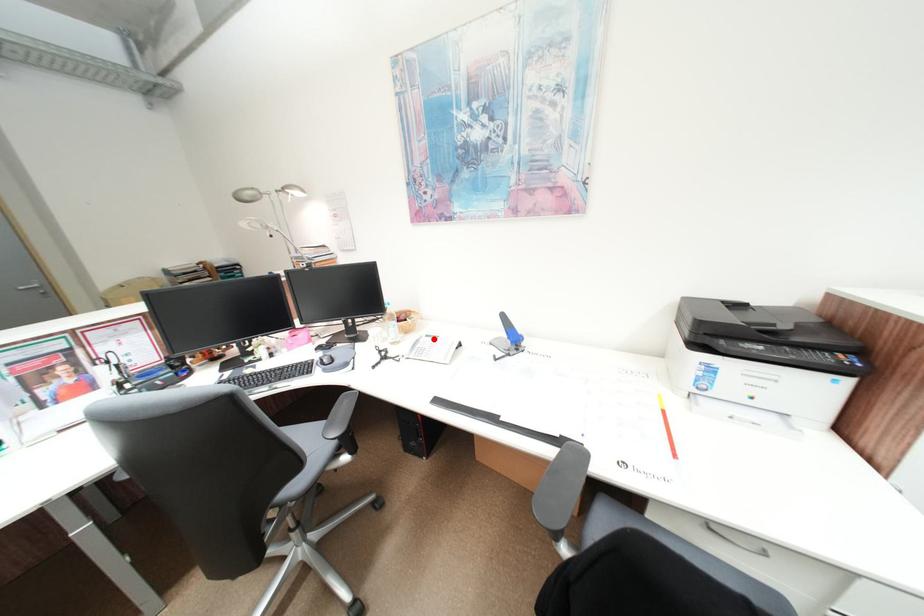
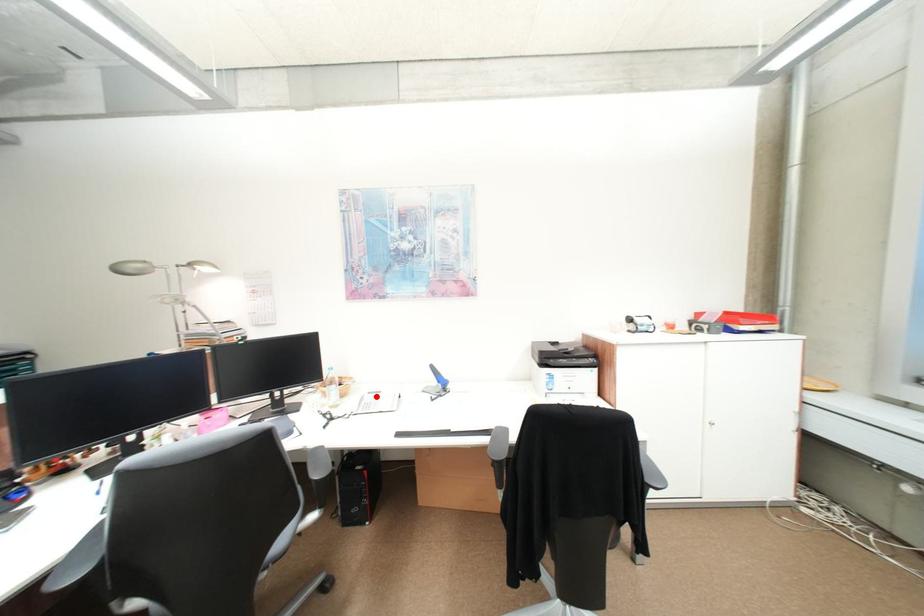
I am providing you with two images of the same scene from different viewpoints. A red point is marked on the first image and another point is marked on the second image. Are the points marked in image1 and image2 representing the same 3D position?

Yes